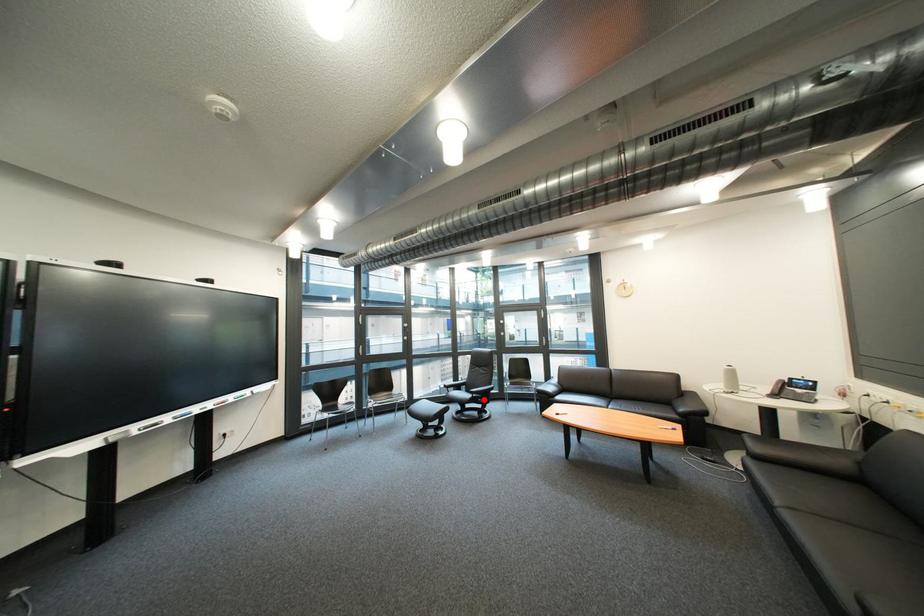
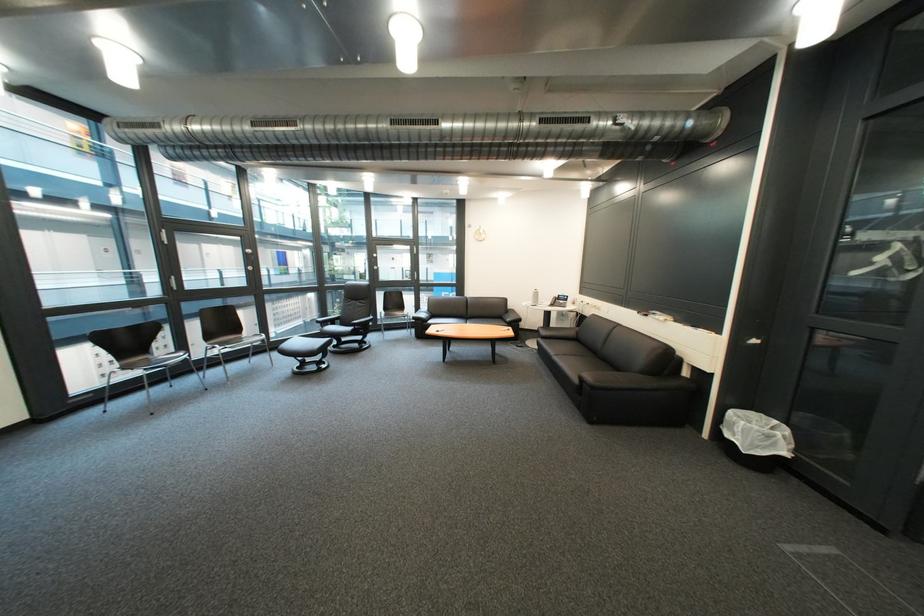
Question: I am providing you with two images of the same scene from different viewpoints. A red point is shown in image1. For the corresponding object point in image2, is it positioned nearer or farther from the camera?

Choices:
 (A) Nearer
 (B) Farther

Answer: (A)